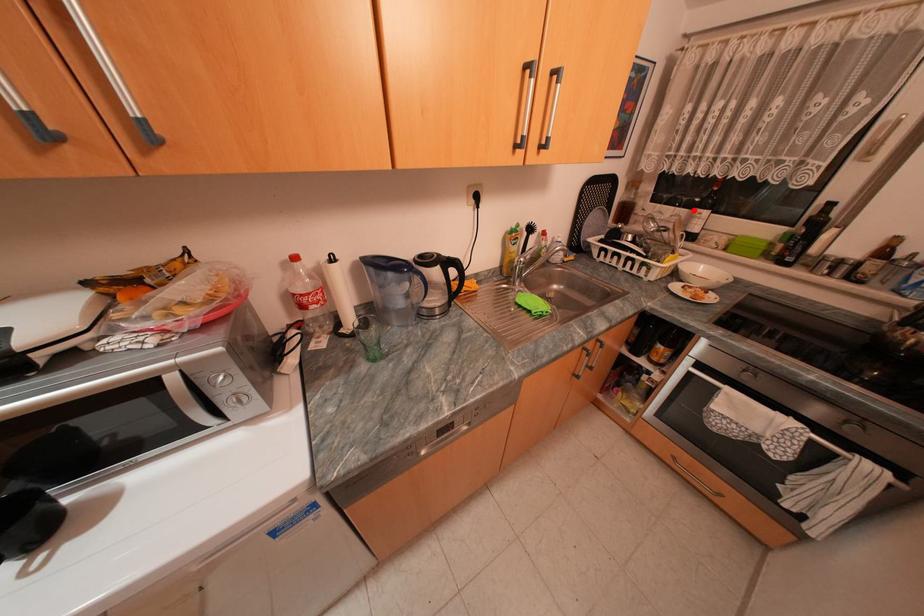
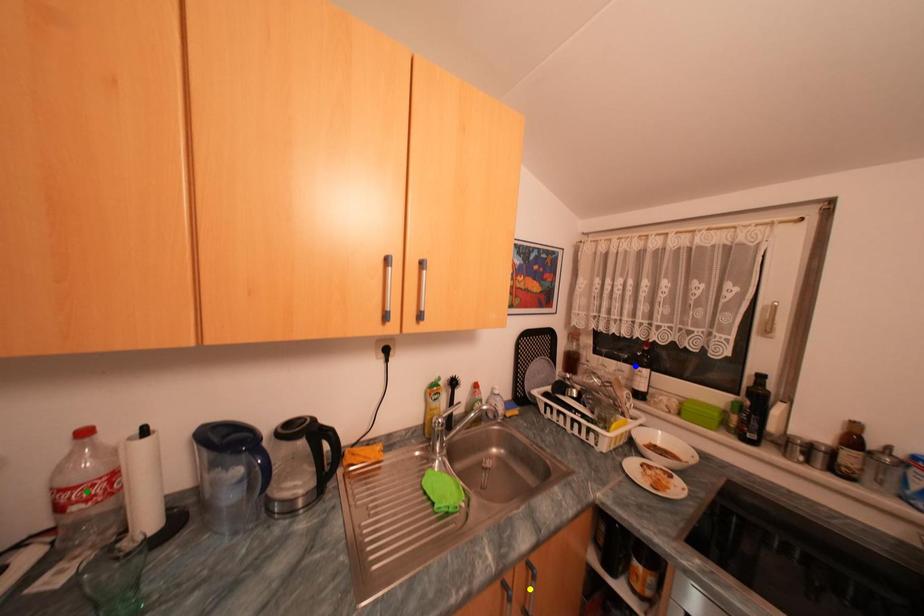
Question: I am providing you with two images of the same scene from different viewpoints. A red point is marked on the first image. You are given multiple points on the second image. Can you choose the point in image 2 that corresponds to the point in image 1?

Choices:
 (A) blue point
 (B) yellow point
 (C) green point

Answer: (A)